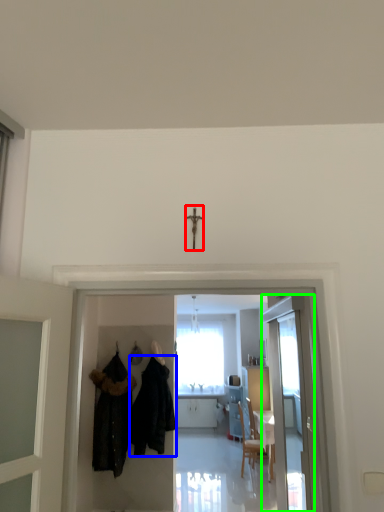
Question: Estimate the real-world distances between objects in this image. Which object is farther from crucifix (highlighted by a red box), fancy dress (highlighted by a blue box) or door (highlighted by a green box)?

Choices:
 (A) fancy dress
 (B) door

Answer: (B)